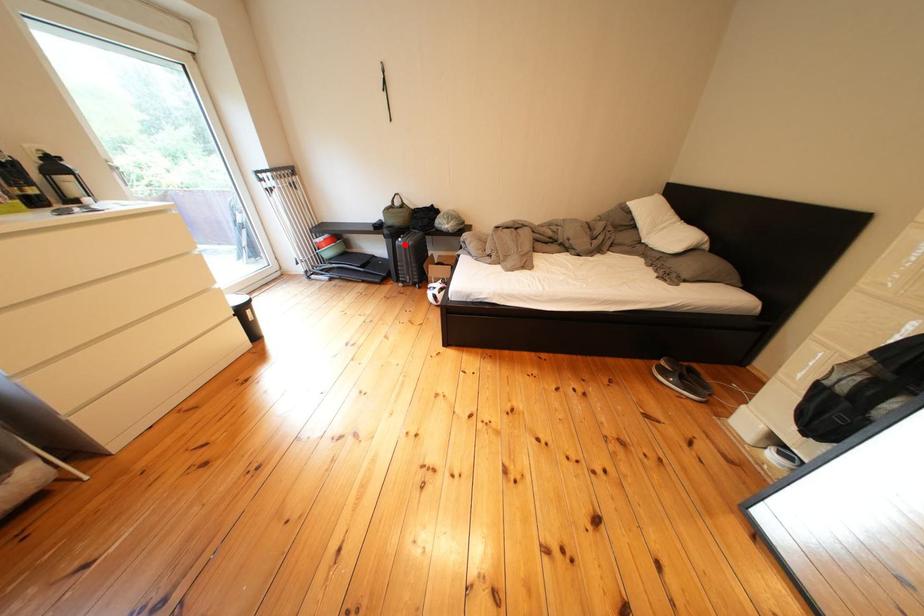
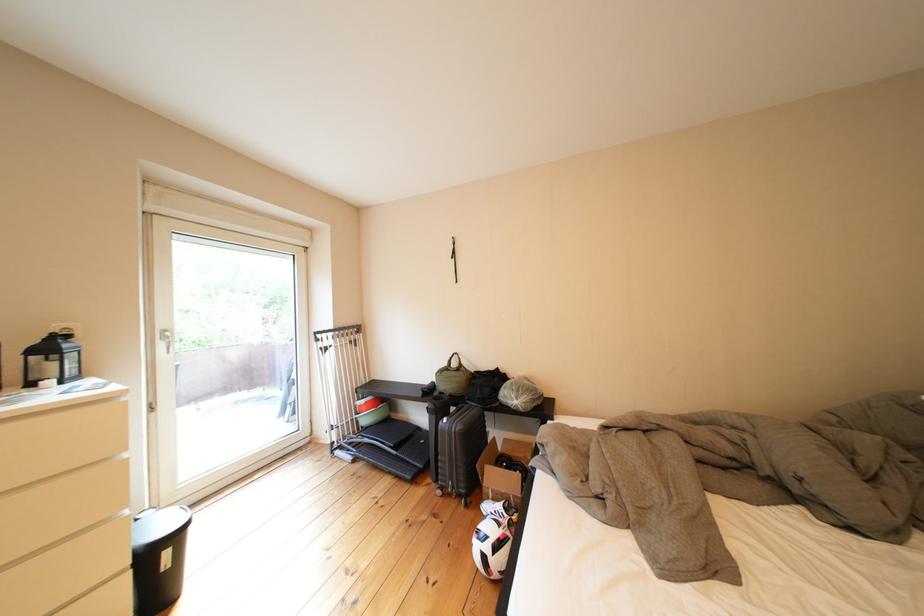
Question: I am providing you with two images of the same scene from different viewpoints. Image1 has a red point marked. In image2, the corresponding 3D location appears at what relative position? Reply with the corresponding letter.

Choices:
 (A) Closer
 (B) Farther

Answer: (B)